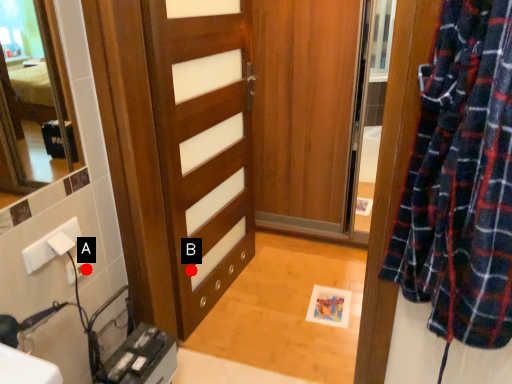
Question: Two points are circled on the image, labeled by A and B beside each circle. Which point is farther from the camera taking this photo?

Choices:
 (A) A is further
 (B) B is further

Answer: (B)